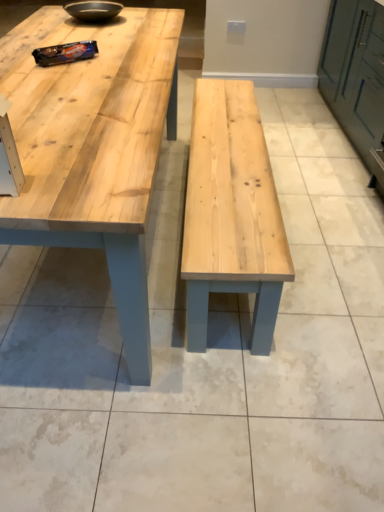
Question: Considering their positions, is matte black bowl at upper center located in front of or behind natural wood table at center?

Choices:
 (A) behind
 (B) front

Answer: (A)

Question: Is point (79, 12) positioned closer to the camera than point (97, 194)?

Choices:
 (A) farther
 (B) closer

Answer: (A)

Question: Considering the real-world distances, which object is closest to the green matte cabinet at right?

Choices:
 (A) natural wood table at center
 (B) matte black bowl at upper center

Answer: (A)

Question: Based on their relative distances, which object is farther from the green matte cabinet at right?

Choices:
 (A) matte black bowl at upper center
 (B) natural wood table at center

Answer: (A)